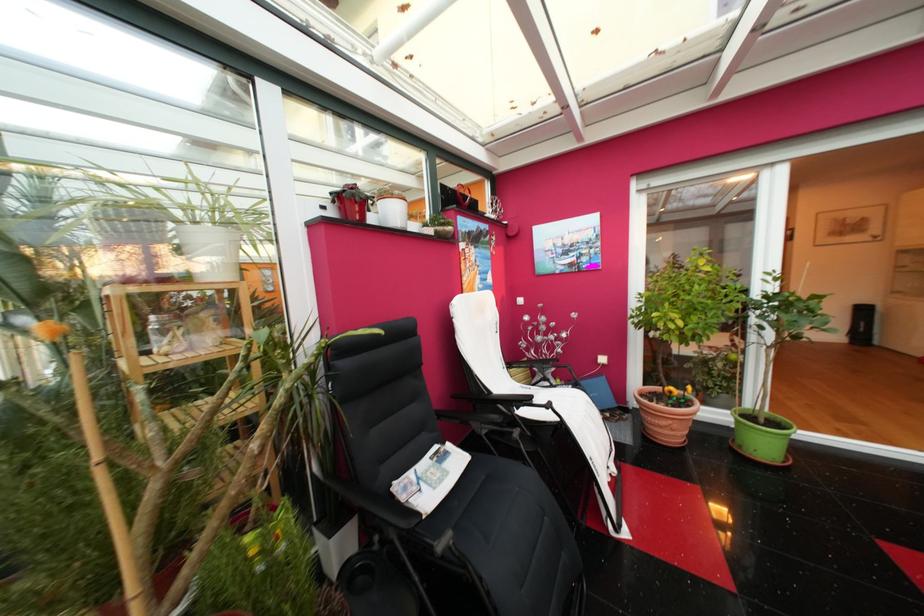
This screenshot has width=924, height=616. Identify the location of magazine. (431, 477).